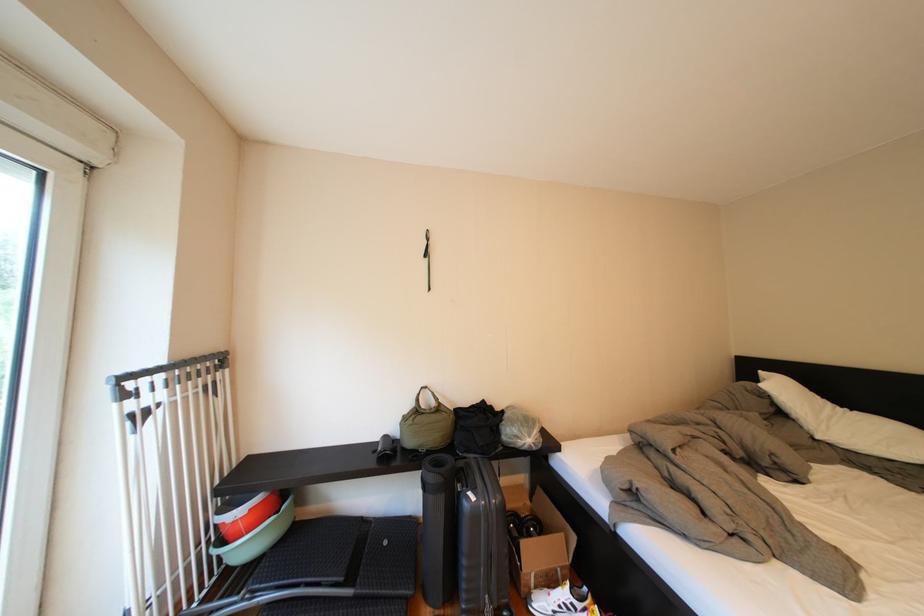
The width and height of the screenshot is (924, 616). In order to click on suitcase handle in this screenshot , I will do coord(481,541).